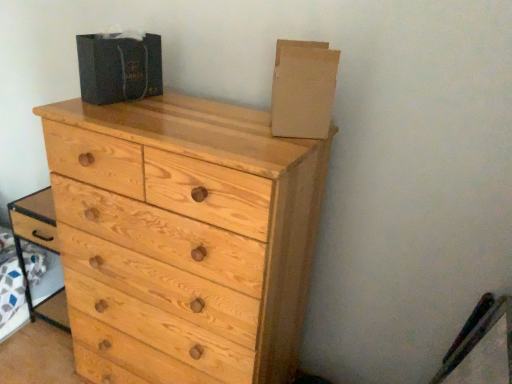
Question: Does dark gray cardboard box at upper center, which is counted as the second cardboard box, starting from the right, have a greater width compared to light wood chest of drawers at center?

Choices:
 (A) yes
 (B) no

Answer: (B)

Question: Is dark gray cardboard box at upper center, positioned as the 1th cardboard box in left-to-right order, oriented towards light wood chest of drawers at center?

Choices:
 (A) no
 (B) yes

Answer: (A)

Question: Considering the relative positions of dark gray cardboard box at upper center, positioned as the 1th cardboard box in left-to-right order, and light wood chest of drawers at center in the image provided, is dark gray cardboard box at upper center, positioned as the 1th cardboard box in left-to-right order, to the right of light wood chest of drawers at center from the viewer's perspective?

Choices:
 (A) no
 (B) yes

Answer: (A)

Question: Can we say dark gray cardboard box at upper center, which is counted as the second cardboard box, starting from the right, lies outside light wood chest of drawers at center?

Choices:
 (A) no
 (B) yes

Answer: (B)

Question: Does dark gray cardboard box at upper center, positioned as the 1th cardboard box in left-to-right order, have a larger size compared to light wood chest of drawers at center?

Choices:
 (A) no
 (B) yes

Answer: (A)

Question: Considering the relative sizes of dark gray cardboard box at upper center, which is counted as the second cardboard box, starting from the right, and light wood chest of drawers at center in the image provided, is dark gray cardboard box at upper center, which is counted as the second cardboard box, starting from the right, thinner than light wood chest of drawers at center?

Choices:
 (A) yes
 (B) no

Answer: (A)

Question: Is light wood chest of drawers at center further to the viewer compared to dark gray cardboard box at upper center, which is counted as the second cardboard box, starting from the right?

Choices:
 (A) yes
 (B) no

Answer: (B)

Question: From the image's perspective, is light wood chest of drawers at center over dark gray cardboard box at upper center, positioned as the 1th cardboard box in left-to-right order?

Choices:
 (A) yes
 (B) no

Answer: (B)

Question: Does light wood chest of drawers at center have a lesser width compared to dark gray cardboard box at upper center, which is counted as the second cardboard box, starting from the right?

Choices:
 (A) no
 (B) yes

Answer: (A)

Question: From a real-world perspective, is light wood chest of drawers at center on top of dark gray cardboard box at upper center, which is counted as the second cardboard box, starting from the right?

Choices:
 (A) no
 (B) yes

Answer: (A)

Question: Does light wood chest of drawers at center turn towards dark gray cardboard box at upper center, positioned as the 1th cardboard box in left-to-right order?

Choices:
 (A) no
 (B) yes

Answer: (A)

Question: Does light wood chest of drawers at center appear on the right side of dark gray cardboard box at upper center, positioned as the 1th cardboard box in left-to-right order?

Choices:
 (A) no
 (B) yes

Answer: (B)

Question: From a real-world perspective, is cardboard at upper right, which is counted as the 1th cardboard box, starting from the right, physically below dark gray cardboard box at upper center, which is counted as the second cardboard box, starting from the right?

Choices:
 (A) no
 (B) yes

Answer: (A)